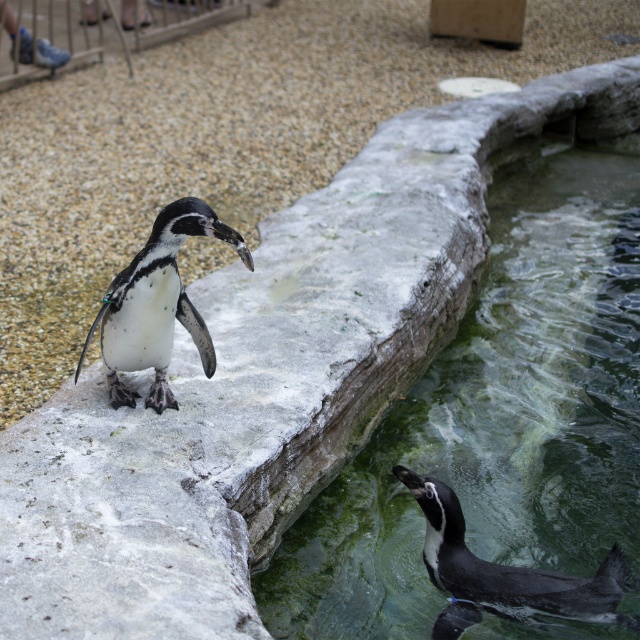
You are a zookeeper observing the penguins. You notice the black glossy penguin at lower right and the green mossy rock at lower center. Which object is closer to you from your vantage point?

The green mossy rock at lower center is closer to you because the black glossy penguin at lower right is positioned behind it.

Consider the image. You are a zookeeper observing the penguins in their enclosure. You notice a point marked at coordinates (156, 305). Which penguin does this point indicate?

The point marked at coordinates (156, 305) indicates the white matte penguin at center.

Based on the photo, you are a visitor at the zoo and want to take a photo of the two penguins. The first penguin is at point (224, 227) and the second penguin is at point (618, 589). Which penguin is closer to you?

The penguin at point (224, 227) is closer to you than the one at point (618, 589).